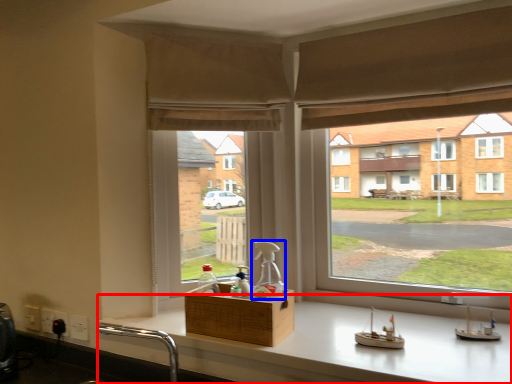
Question: Among these objects, which one is farthest to the camera, counter (highlighted by a red box) or bottle (highlighted by a blue box)?

Choices:
 (A) counter
 (B) bottle

Answer: (B)